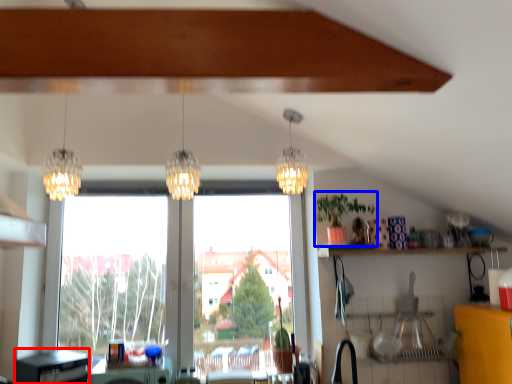
Question: Among these objects, which one is nearest to the camera, dish washer (highlighted by a red box) or houseplant (highlighted by a blue box)?

Choices:
 (A) dish washer
 (B) houseplant

Answer: (A)